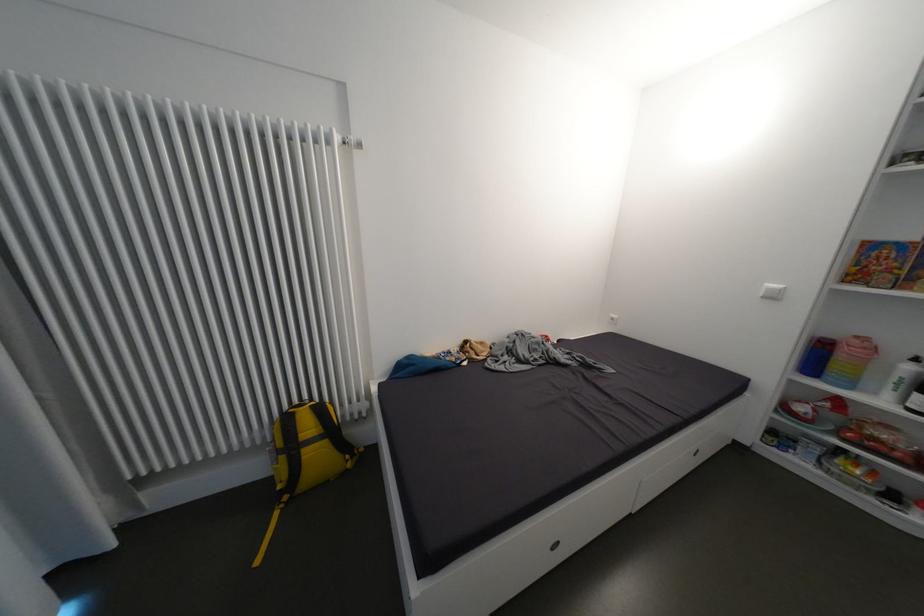
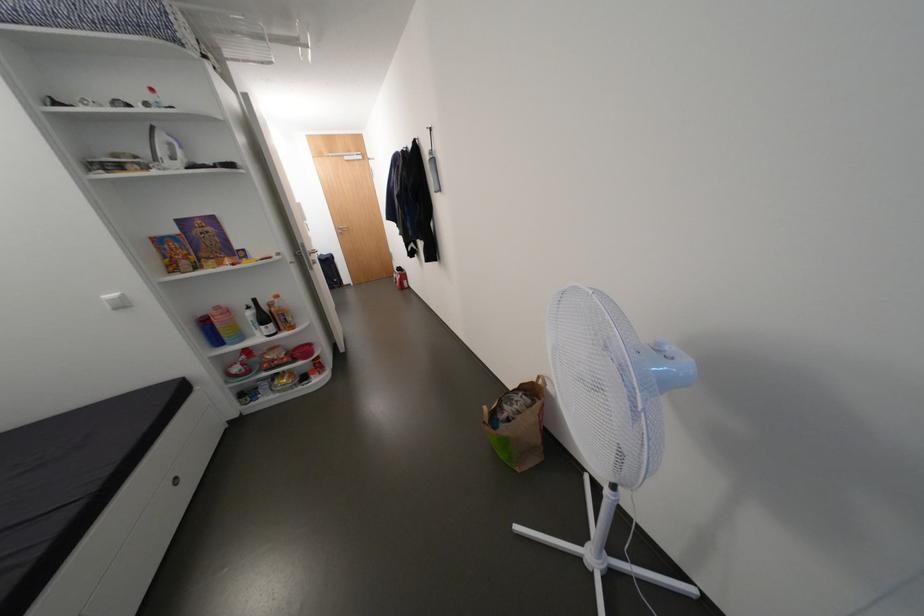
The first image is from the beginning of the video and the second image is from the end. How did the camera likely rotate when shooting the video?

The rotation direction of the camera is right-down.